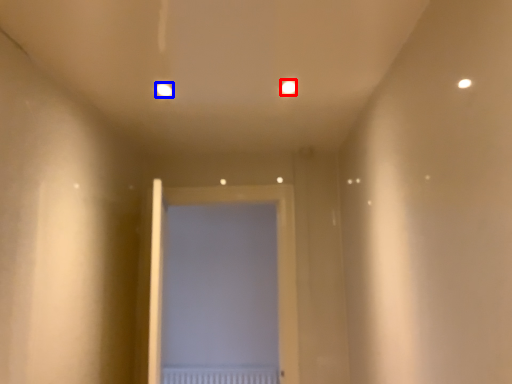
Question: Which object appears closest to the camera in this image, light (highlighted by a red box) or light (highlighted by a blue box)?

Choices:
 (A) light
 (B) light

Answer: (A)